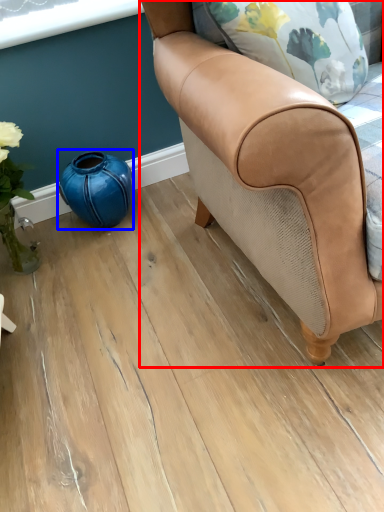
Question: Which of the following is the farthest to the observer, chair (highlighted by a red box) or teal (highlighted by a blue box)?

Choices:
 (A) chair
 (B) teal

Answer: (B)